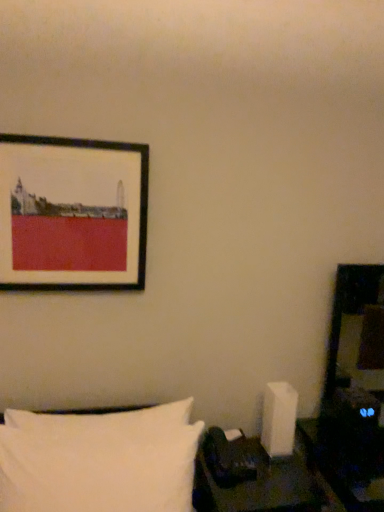
Describe the element at coordinates (261, 487) in the screenshot. I see `black leather table at lower right` at that location.

Locate an element on the screen. The image size is (384, 512). white soft pillow at lower left is located at coordinates (99, 460).

Considering the positions of point (17, 456) and point (100, 250), is point (17, 456) closer or farther from the camera than point (100, 250)?

Clearly, point (17, 456) is closer to the camera than point (100, 250).

Considering the relative positions of white soft pillow at lower left and matte black picture frame at upper left in the image provided, is white soft pillow at lower left to the right of matte black picture frame at upper left from the viewer's perspective?

Yes, white soft pillow at lower left is to the right of matte black picture frame at upper left.

Is white soft pillow at lower left positioned in front of matte black picture frame at upper left?

Yes, it is in front of matte black picture frame at upper left.

Is matte black picture frame at upper left looking in the opposite direction of white soft pillow at lower left?

No.

Would you say white soft pillow at lower left is part of matte black picture frame at upper left's contents?

No, white soft pillow at lower left is located outside of matte black picture frame at upper left.

Where is `pillow below the matte black picture frame at upper left (from the image's perspective)`? This screenshot has height=512, width=384. pillow below the matte black picture frame at upper left (from the image's perspective) is located at coordinates (99, 460).

Is point (138, 276) positioned after point (3, 443)?

Yes, point (138, 276) is behind point (3, 443).

From a real-world perspective, is white soft pillow at lower left under black leather table at lower right?

Actually, white soft pillow at lower left is physically above black leather table at lower right in the real world.

In the image, is white soft pillow at lower left positioned in front of or behind black leather table at lower right?

Clearly, white soft pillow at lower left is in front of black leather table at lower right.

How different are the orientations of white soft pillow at lower left and black leather table at lower right in degrees?

The facing directions of white soft pillow at lower left and black leather table at lower right are 2.19 degrees apart.

Between white soft pillow at lower left and black leather table at lower right, which one has less height?

With less height is black leather table at lower right.

Can you tell me how much black leather table at lower right and white soft pillow at lower left differ in facing direction?

There is a 2.19-degree angle between the facing directions of black leather table at lower right and white soft pillow at lower left.

From a real-world perspective, is black leather table at lower right located higher than white soft pillow at lower left?

No, from a real-world perspective, black leather table at lower right is not over white soft pillow at lower left

Who is smaller, black leather table at lower right or white soft pillow at lower left?

black leather table at lower right.

How far apart are matte black picture frame at upper left and black leather table at lower right?

matte black picture frame at upper left and black leather table at lower right are 36.80 inches apart from each other.

The width and height of the screenshot is (384, 512). I want to click on picture frame on the left of black leather table at lower right, so coord(72,214).

Are matte black picture frame at upper left and black leather table at lower right beside each other?

No, matte black picture frame at upper left is not beside black leather table at lower right.

Looking at this image, from the image's perspective, is matte black picture frame at upper left located beneath black leather table at lower right?

No.

From the image's perspective, does black leather table at lower right appear higher than matte black picture frame at upper left?

Actually, black leather table at lower right appears below matte black picture frame at upper left in the image.

From a real-world perspective, is black leather table at lower right under matte black picture frame at upper left?

Indeed, from a real-world perspective, black leather table at lower right is positioned beneath matte black picture frame at upper left.

Which is nearer, (232,494) or (28,145)?

Point (232,494) is farther from the camera than point (28,145).

Is black leather table at lower right oriented towards matte black picture frame at upper left?

No, black leather table at lower right is not facing towards matte black picture frame at upper left.

Find the location of a particular element. picture frame lying behind the white soft pillow at lower left is located at coordinates (72, 214).

Locate an element on the screen. This screenshot has width=384, height=512. pillow on the right of the matte black picture frame at upper left is located at coordinates (99, 460).

When comparing their distances from matte black picture frame at upper left, does white soft pillow at lower left or black leather table at lower right seem closer?

white soft pillow at lower left is positioned closer to the anchor matte black picture frame at upper left.

Considering their positions, is black leather table at lower right positioned closer to matte black picture frame at upper left than white soft pillow at lower left?

white soft pillow at lower left.

Looking at the image, which one is located closer to black leather table at lower right, white soft pillow at lower left or matte black picture frame at upper left?

Among the two, white soft pillow at lower left is located nearer to black leather table at lower right.

Based on their spatial positions, is matte black picture frame at upper left or black leather table at lower right closer to white soft pillow at lower left?

The object closer to white soft pillow at lower left is black leather table at lower right.

Looking at the image, which one is located closer to white soft pillow at lower left, black leather table at lower right or matte black picture frame at upper left?

black leather table at lower right is closer to white soft pillow at lower left.

Considering their positions, is matte black picture frame at upper left positioned closer to black leather table at lower right than white soft pillow at lower left?

white soft pillow at lower left.

Identify the location of pillow between matte black picture frame at upper left and black leather table at lower right vertically. (99, 460).